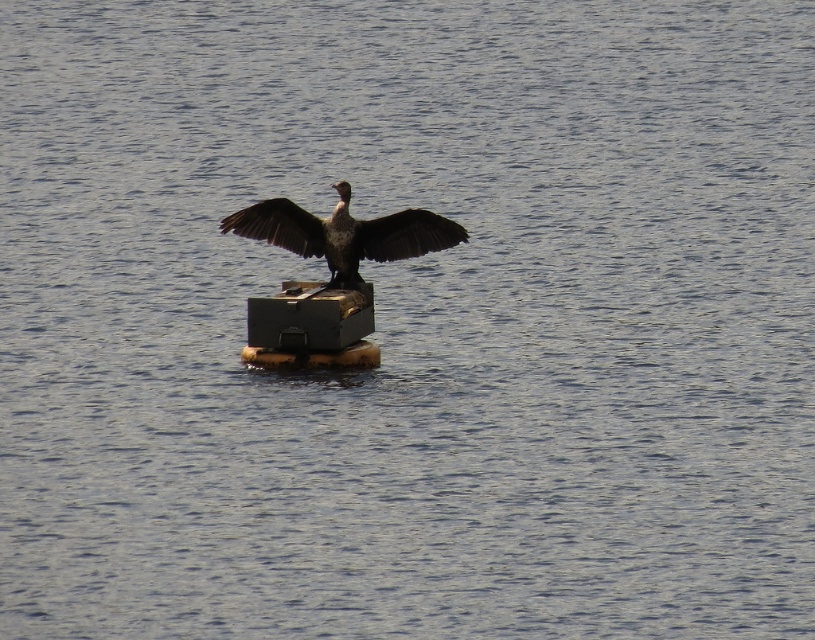
You are a bird flying over the water and want to land on the dark brown feathers at center. Can you safely land there?

The dark brown feathers at center are located at point (x=344, y=234), so yes, you can safely land there as it is a stable location.

You are standing on the edge of the water and see both the dark brown feathers at center and the dark brown feathered wing at center. Which object is closer to you?

The dark brown feathers at center is closer to the viewer than the dark brown feathered wing at center.

Based on the photo, you are standing at the edge of the water and see two points in the scene. Which point is closer to you, point (443, 216) or point (271, 212)?

Point (271, 212) is closer to you because it is less further to the viewer than point (443, 216).